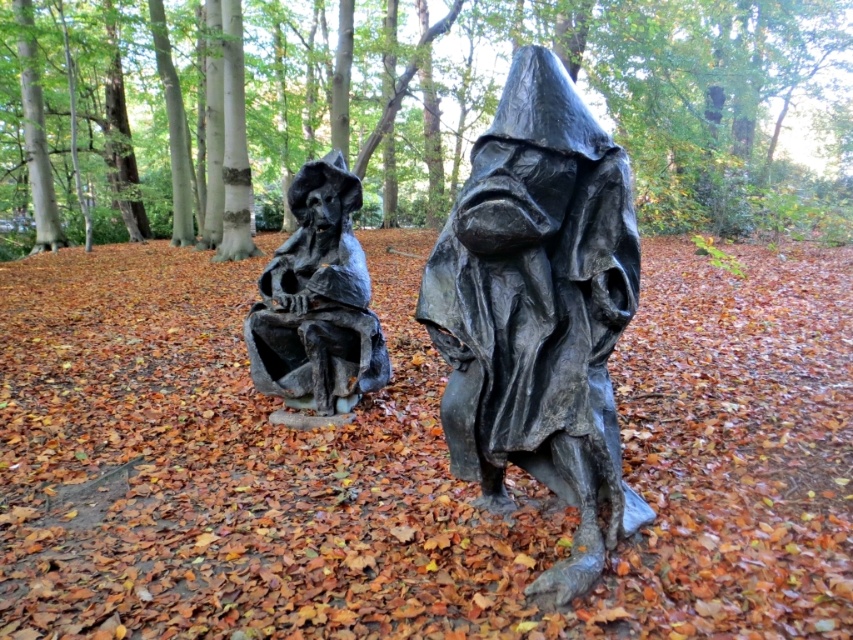
You are an art curator planning to move both the matte black figure at center and the matte black statue at center into a gallery. The gallery has a narrow hallway that can only accommodate items up to 2 meters in width. Which of the two sculptures would you prioritize moving first to ensure they both fit through the hallway?

The matte black statue at center has a smaller width than the matte black figure at center. Since the hallway can only accommodate items up to 2 meters wide, you should move the matte black statue at center first to ensure both can fit through the hallway.

You are standing in the forest and see the two sculptures. The point at coordinates (x=538, y=310) marks a specific location. Which sculpture does this point correspond to?

The point at coordinates (x=538, y=310) corresponds to the matte black figure at center.